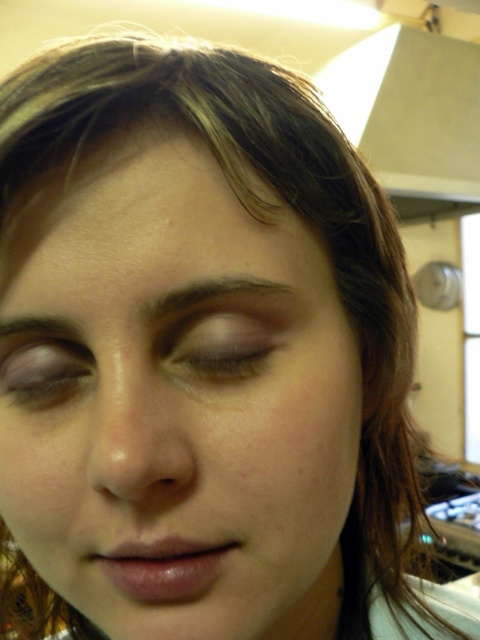
You are a makeup artist preparing to apply contouring to the matte skin nose at center and the matte brown eye at lower left. Which of the two requires a larger contouring product amount based on their size?

The matte skin nose at center is bigger than the matte brown eye at lower left, so it requires a larger contouring product amount.

Looking at the person in the image, where is the matte brown eye at center relative to the dark brown eyebrow at upper left?

The matte brown eye at center is to the right of the dark brown eyebrow at upper left.